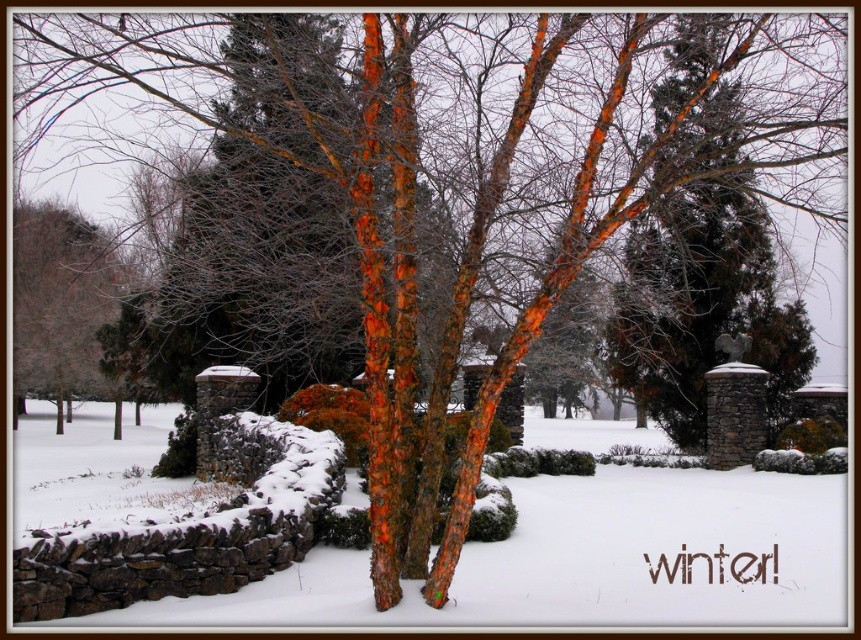
Question: Does white powdery snow at center lie in front of brown bark tree at left?

Choices:
 (A) no
 (B) yes

Answer: (B)

Question: Is white powdery snow at center to the right of brown bark tree at left from the viewer's perspective?

Choices:
 (A) no
 (B) yes

Answer: (B)

Question: In this image, where is white powdery snow at center located relative to brown bark tree at left?

Choices:
 (A) below
 (B) above

Answer: (A)

Question: Which point is farther to the camera?

Choices:
 (A) click(x=829, y=536)
 (B) click(x=34, y=321)

Answer: (B)

Question: Which object is closer to the camera taking this photo?

Choices:
 (A) white powdery snow at center
 (B) brown bark tree at left

Answer: (A)